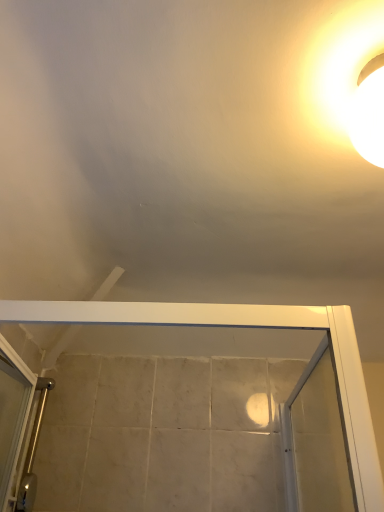
Find the location of a particular element. The image size is (384, 512). white glossy light fixture at upper right is located at coordinates (369, 112).

This screenshot has width=384, height=512. Describe the element at coordinates (369, 112) in the screenshot. I see `white glossy light fixture at upper right` at that location.

The image size is (384, 512). I want to click on white glossy light fixture at upper right, so click(x=369, y=112).